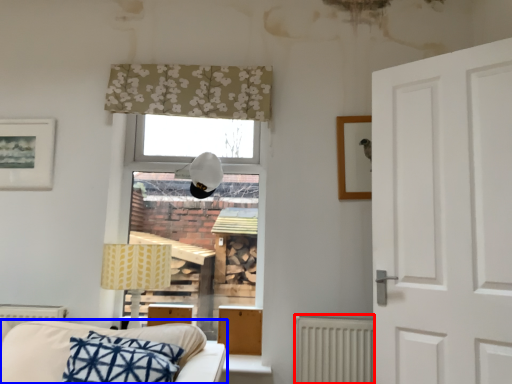
Question: Among these objects, which one is nearest to the camera, radiator (highlighted by a red box) or studio couch (highlighted by a blue box)?

Choices:
 (A) radiator
 (B) studio couch

Answer: (B)